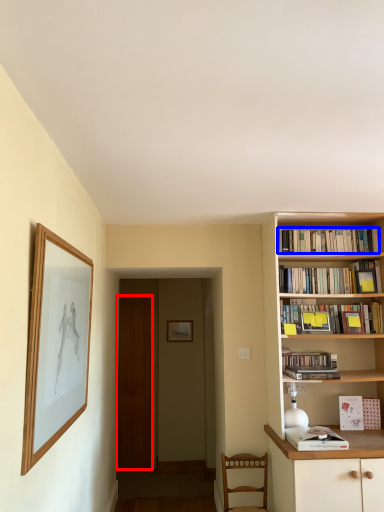
Question: Which object appears closest to the camera in this image, glass door (highlighted by a red box) or book (highlighted by a blue box)?

Choices:
 (A) glass door
 (B) book

Answer: (B)